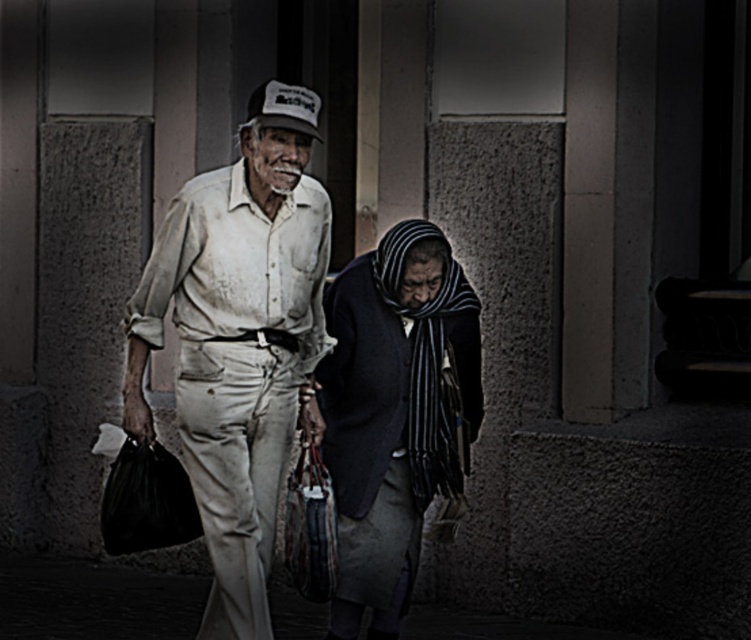
Looking at this image, which of these two, worn beige pants at center or dark blue woolen scarf at center, stands shorter?

dark blue woolen scarf at center

Does worn beige pants at center have a lesser height compared to dark blue woolen scarf at center?

Incorrect, worn beige pants at center's height does not fall short of dark blue woolen scarf at center's.

Is point (249, 416) positioned in front of point (359, 442)?

That is True.

You are a GUI agent. You are given a task and a screenshot of the screen. Output one action in this format:
    pyautogui.click(x=<x>, y=<y>)
    Task: Click on the worn beige pants at center
    
    Given the screenshot: What is the action you would take?
    pyautogui.click(x=240, y=340)